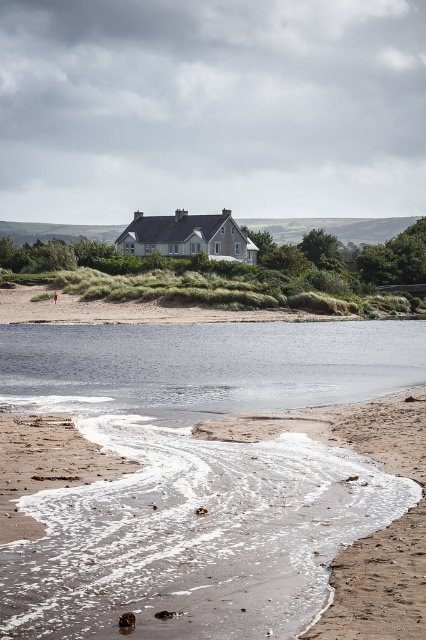
Is sandy beach at lower left taller than clear water at center?

Incorrect, sandy beach at lower left's height is not larger of clear water at center's.

Is point (353, 572) in front of point (8, 333)?

That is True.

Is point (69, 502) closer to camera compared to point (69, 355)?

Yes, point (69, 502) is closer to viewer.

Identify the location of sandy beach at lower left. (213, 531).